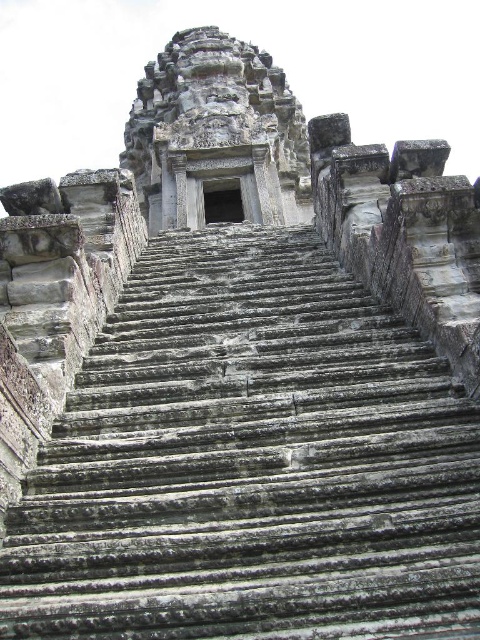
You are standing at the bottom of the gray stone stairs at center and want to reach the gray stone temple at center. Which direction should you move to get closer to the temple?

You should move upward along the gray stone stairs at center to get closer to the gray stone temple at center since the stairs lead directly to the temple.

You are standing at the bottom of the gray stone stairs at center and want to reach the gray stone temple at center. Which direction should you move to get there?

You should move upward towards the gray stone temple at center since the gray stone stairs at center are located below it.